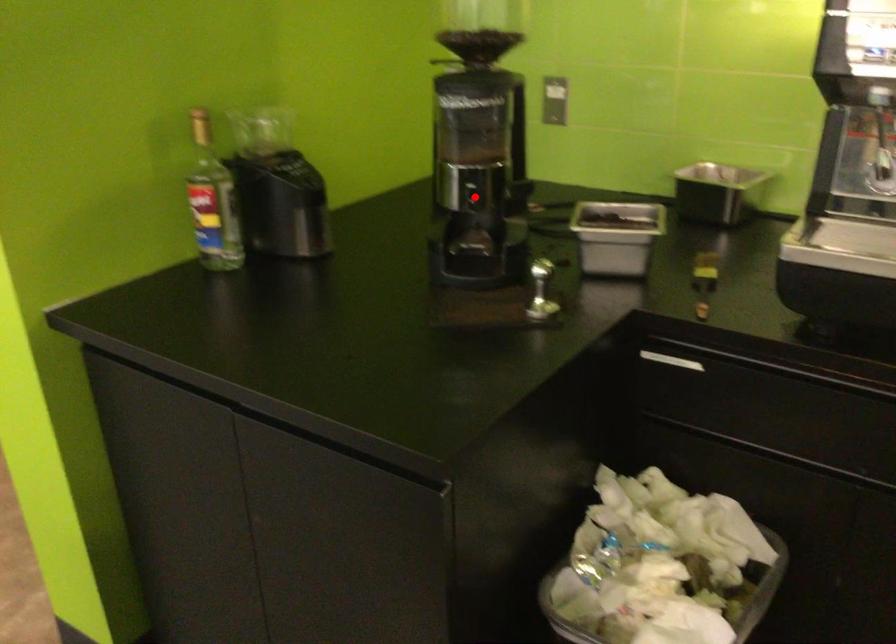
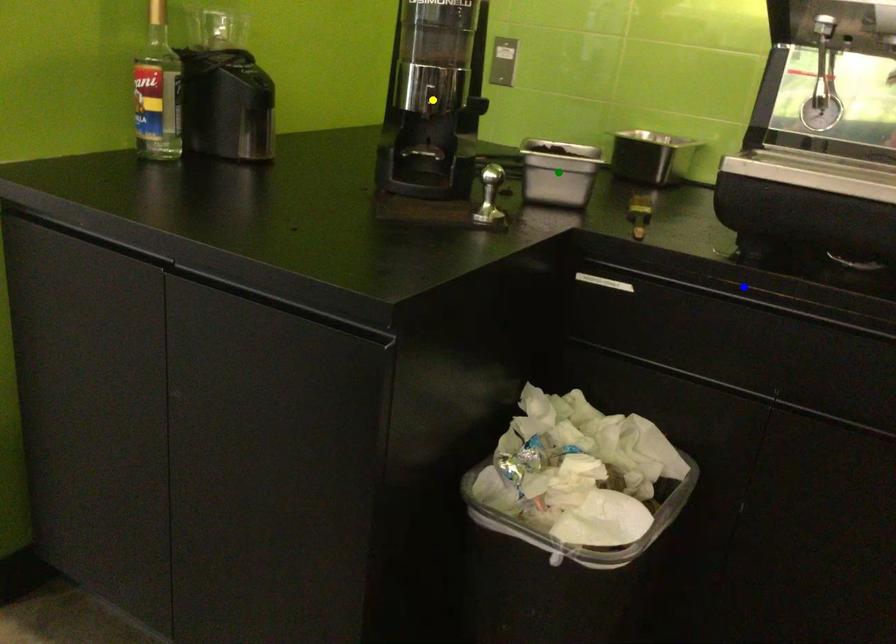
Question: I am providing you with two images of the same scene from different viewpoints. A red point is marked on the first image. You are given multiple points on the second image. Which point in image 2 is actually the same real-world point as the red point in image 1?

Choices:
 (A) green point
 (B) blue point
 (C) yellow point

Answer: (C)